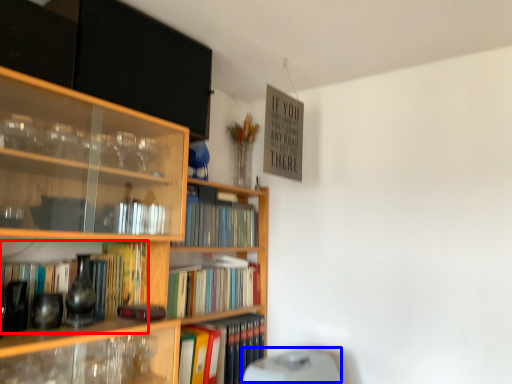
Question: Among these objects, which one is farthest to the camera, book (highlighted by a red box) or water heater (highlighted by a blue box)?

Choices:
 (A) book
 (B) water heater

Answer: (B)